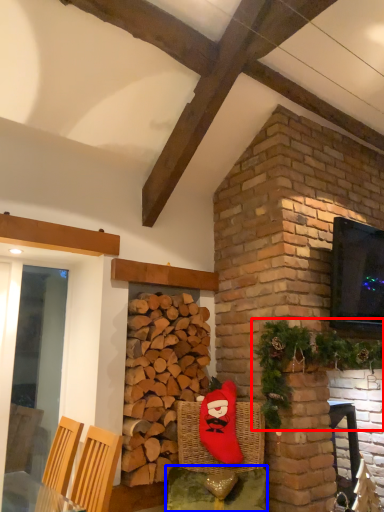
Question: Which object appears closest to the camera in this image, christmas decoration (highlighted by a red box) or table (highlighted by a blue box)?

Choices:
 (A) christmas decoration
 (B) table

Answer: (A)